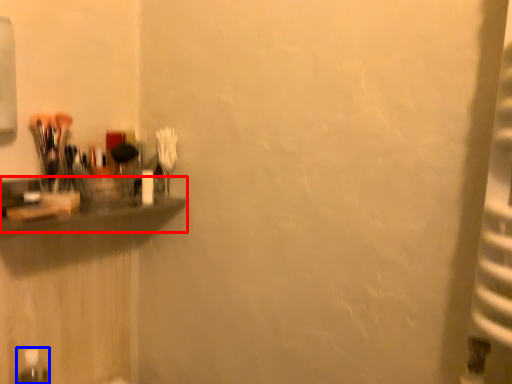
Question: Among these objects, which one is farthest to the camera, shelf (highlighted by a red box) or bottle (highlighted by a blue box)?

Choices:
 (A) shelf
 (B) bottle

Answer: (B)